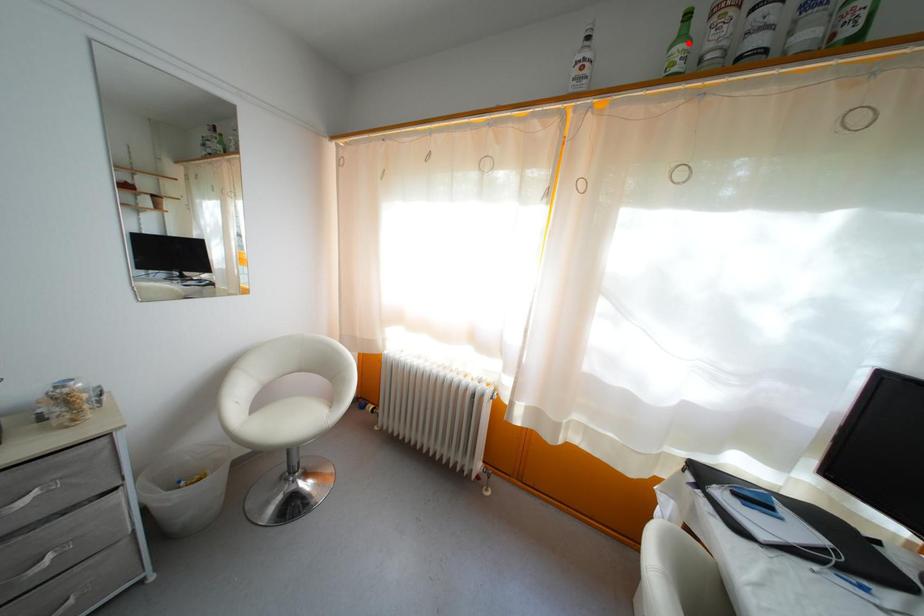
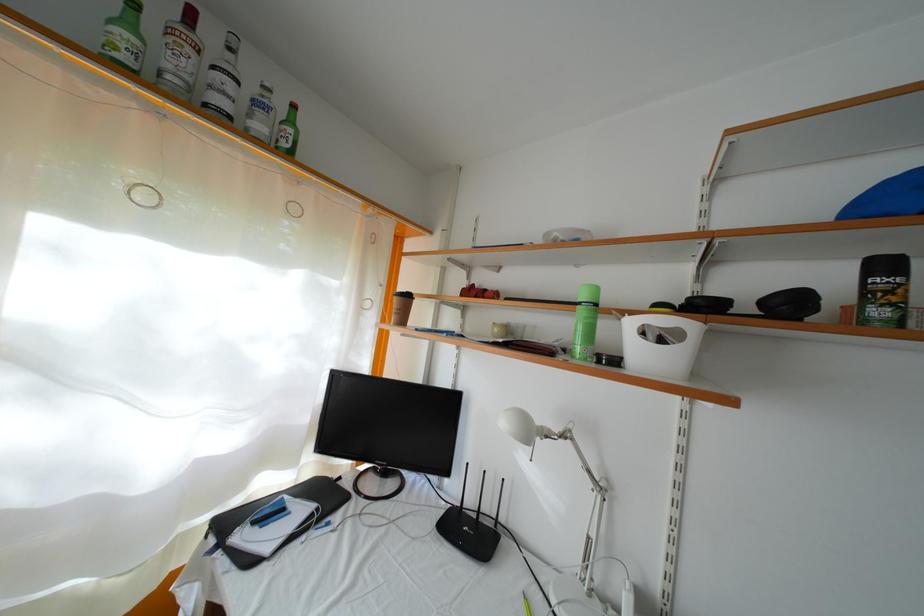
Where in the second image is the point corresponding to the highlighted location from the first image?

(134, 31)